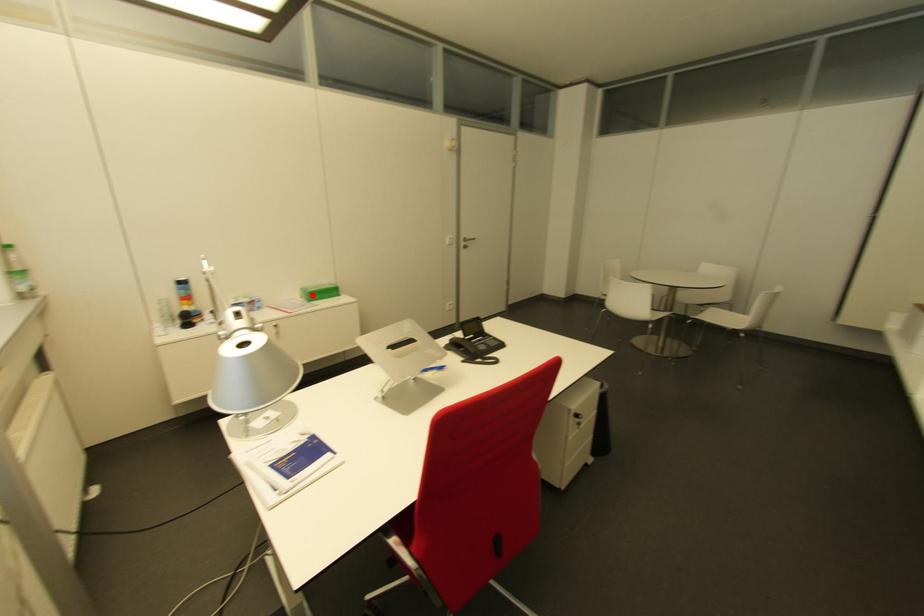
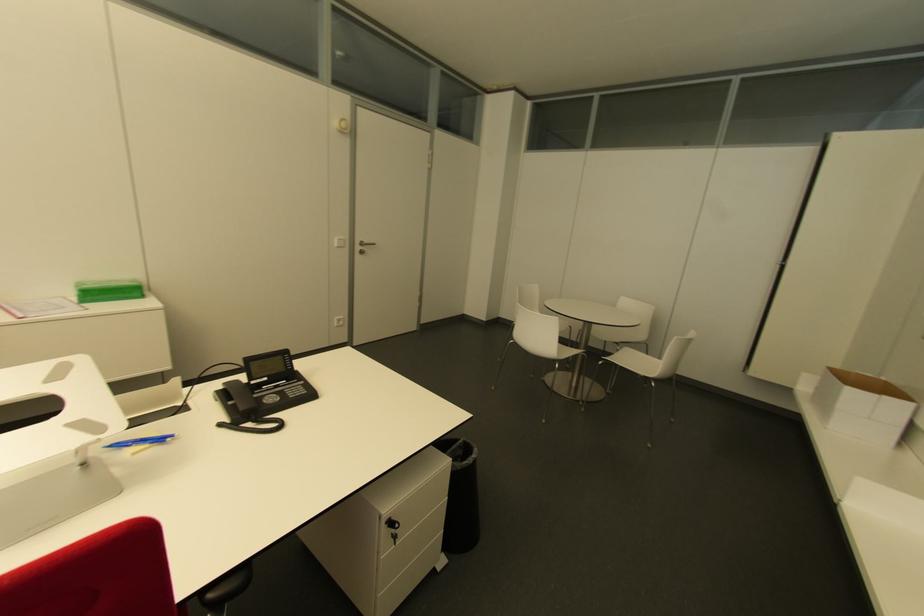
Locate, in the second image, the point that corresponds to the highlighted location in the first image.

(92, 294)